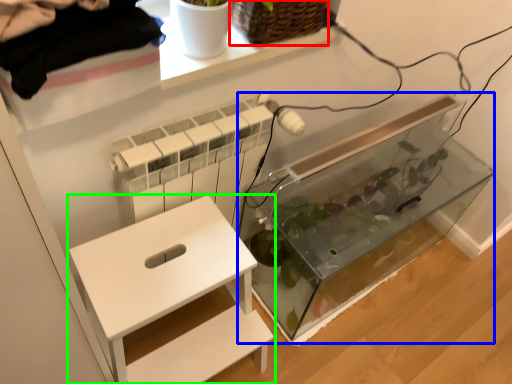
Question: Based on their relative distances, which object is farther from basket (highlighted by a red box)? Choose from glass box (highlighted by a blue box) and furniture (highlighted by a green box).

Choices:
 (A) glass box
 (B) furniture

Answer: (A)